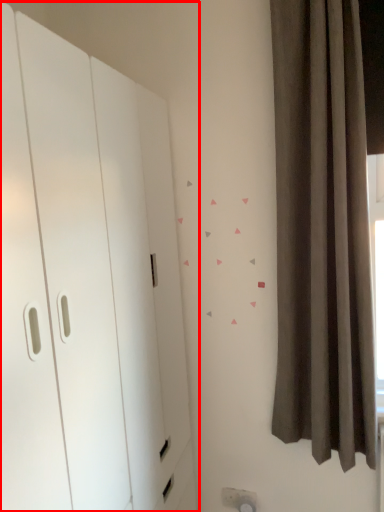
Question: From the image's perspective, what is the correct spatial relationship of dresser (annotated by the red box) in relation to curtain?

Choices:
 (A) above
 (B) below

Answer: (B)